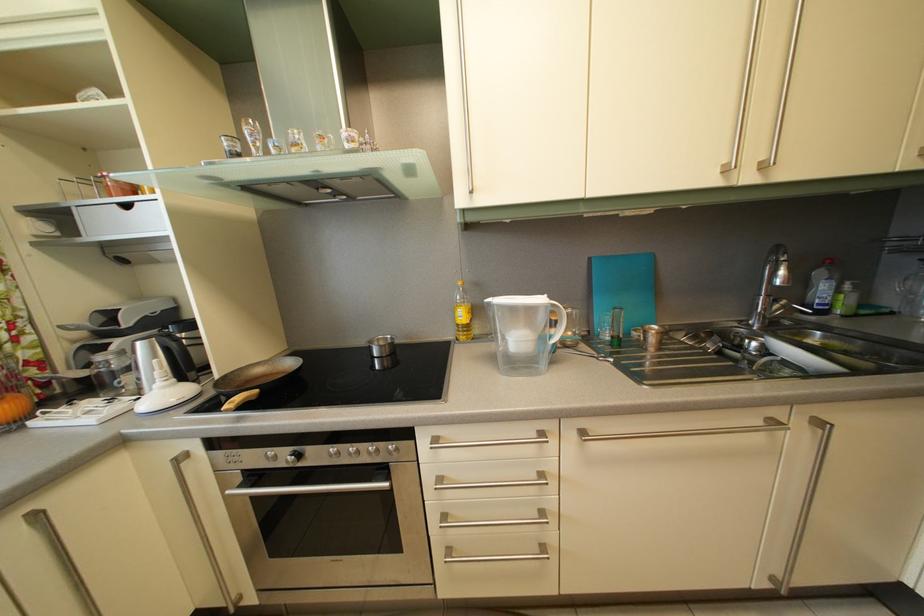
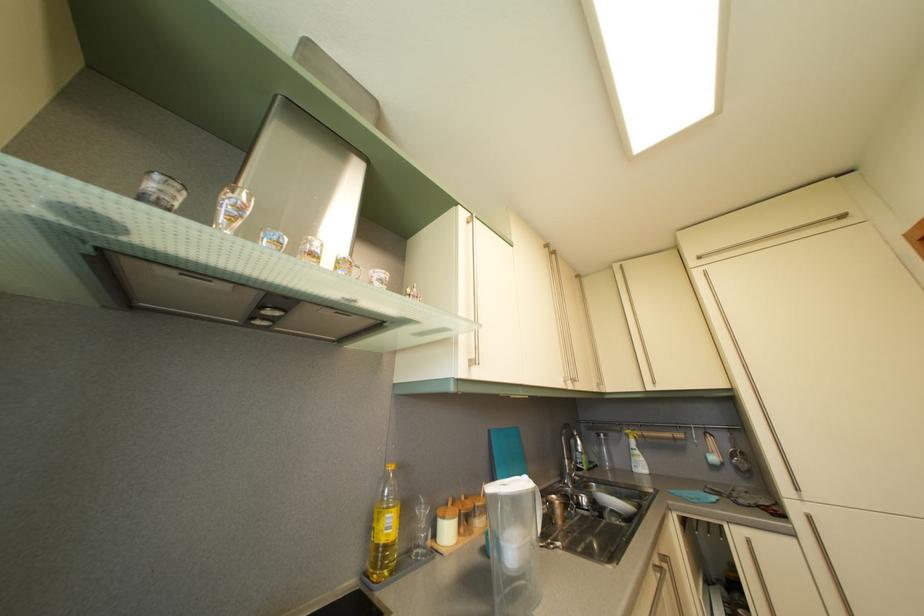
In the second image, find the point that corresponds to (470,323) in the first image.

(396, 533)